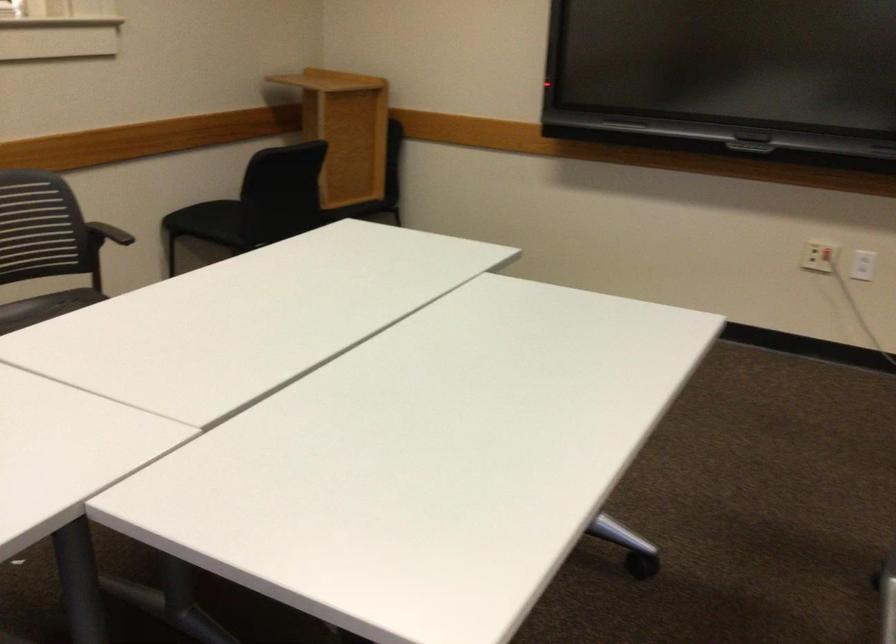
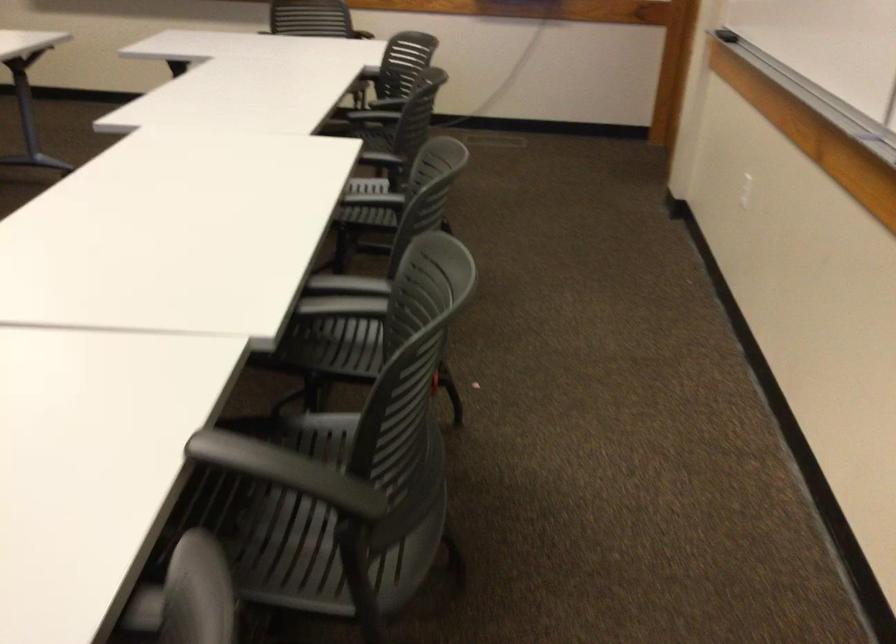
Question: The images are taken continuously from a first-person perspective. In which direction are you moving?

Choices:
 (A) Left
 (B) Right
 (C) Forward
 (D) Backward

Answer: (D)